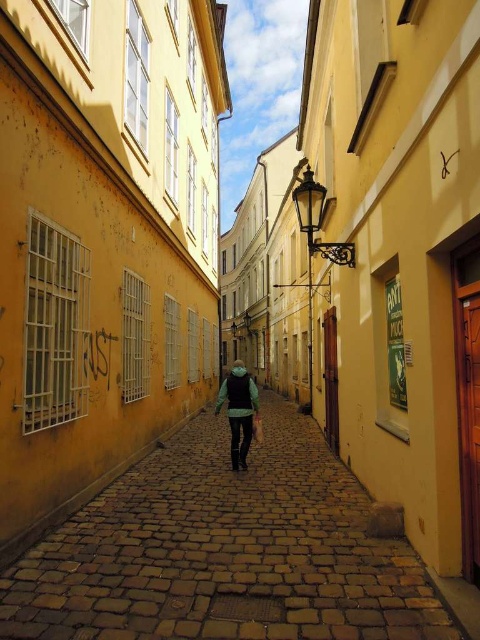
Question: Among these objects, which one is nearest to the camera?

Choices:
 (A) green fabric jacket at center
 (B) brown cobblestone path at center

Answer: (B)

Question: Among these objects, which one is nearest to the camera?

Choices:
 (A) green fabric jacket at center
 (B) brown cobblestone path at center

Answer: (B)

Question: Is brown cobblestone path at center above green fabric jacket at center?

Choices:
 (A) yes
 (B) no

Answer: (B)

Question: Is brown cobblestone path at center above green fabric jacket at center?

Choices:
 (A) yes
 (B) no

Answer: (B)

Question: Which of the following is the closest to the observer?

Choices:
 (A) (259, 468)
 (B) (249, 385)

Answer: (A)

Question: Observing the image, what is the correct spatial positioning of brown cobblestone path at center in reference to green fabric jacket at center?

Choices:
 (A) right
 (B) left

Answer: (A)